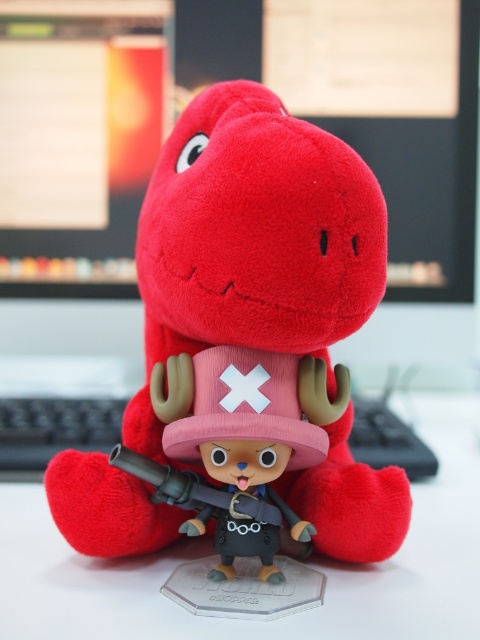
Question: Among these points, which one is nearest to the camera?

Choices:
 (A) (400, 564)
 (B) (249, 108)

Answer: (B)

Question: Is velvet plush dinosaur at center to the left of white glossy computer desk at center from the viewer's perspective?

Choices:
 (A) no
 (B) yes

Answer: (B)

Question: Among these objects, which one is farthest from the camera?

Choices:
 (A) white glossy computer desk at center
 (B) velvet plush dinosaur at center

Answer: (A)

Question: Is velvet plush dinosaur at center to the left of white glossy computer desk at center from the viewer's perspective?

Choices:
 (A) yes
 (B) no

Answer: (A)

Question: Does velvet plush dinosaur at center appear under white glossy computer desk at center?

Choices:
 (A) yes
 (B) no

Answer: (B)